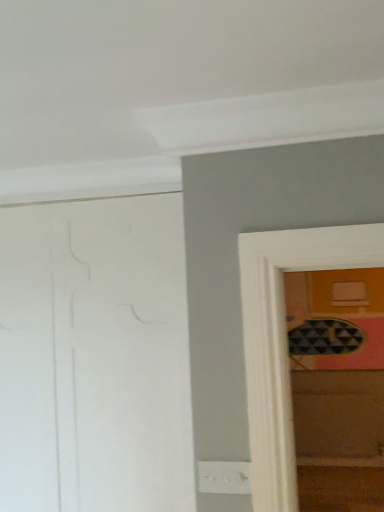
Identify the location of empty space that is ontop of white matte door at left. click(x=86, y=195).